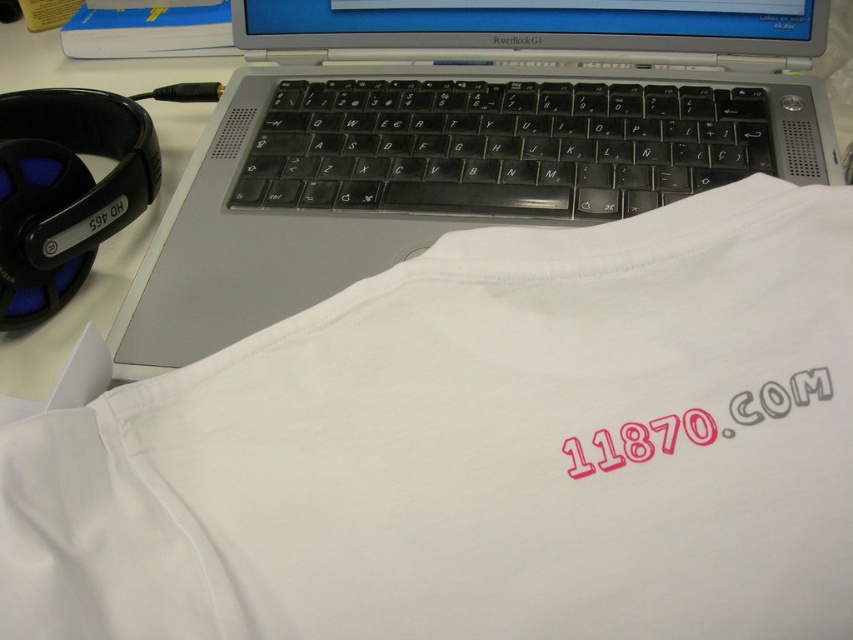
You are looking at the workspace setup. There are two points marked on the image. One is at point (463, 598) and the other at point (288, 193). Which of these two points is closer to you?

Point (463, 598) is closer to the viewer than point (288, 193).